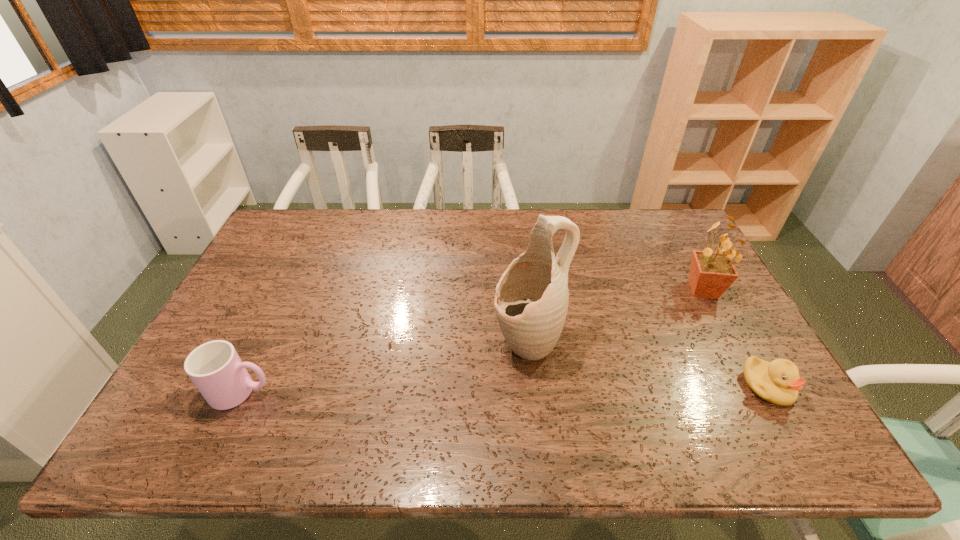
At what (x,y) coordinates should I click in order to perform the action: click on vacant point located between the pitcher and the sunflower. Please return your answer as a coordinate pair (x, y). This screenshot has height=540, width=960. Looking at the image, I should click on (616, 316).

Locate an element on the screen. free space between the pitcher and the third tallest object is located at coordinates (385, 367).

Locate an element on the screen. blank region between the third object from right to left and the shortest object is located at coordinates (648, 364).

Locate an element on the screen. vacant space in between the second object from left to right and the third tallest object is located at coordinates (385, 367).

Where is `free spot between the leftmost object and the pitcher`? free spot between the leftmost object and the pitcher is located at coordinates (385, 367).

Image resolution: width=960 pixels, height=540 pixels. Identify the location of free space that is in between the shortest object and the tallest object. (648, 364).

The image size is (960, 540). What are the coordinates of `empty space that is in between the farthest object and the pitcher` in the screenshot? It's located at (616, 316).

You are a GUI agent. You are given a task and a screenshot of the screen. Output one action in this format:
    pyautogui.click(x=<x>, y=<y>)
    Task: Click on the closest object relative to the third tallest object
    The image size is (960, 540).
    Given the screenshot: What is the action you would take?
    pyautogui.click(x=531, y=301)

Identify which object is the third closest to the farthest object. Please provide its 2D coordinates. Your answer should be formatted as a tuple, i.e. [(x, y)], where the tuple contains the x and y coordinates of a point satisfying the conditions above.

[(215, 368)]